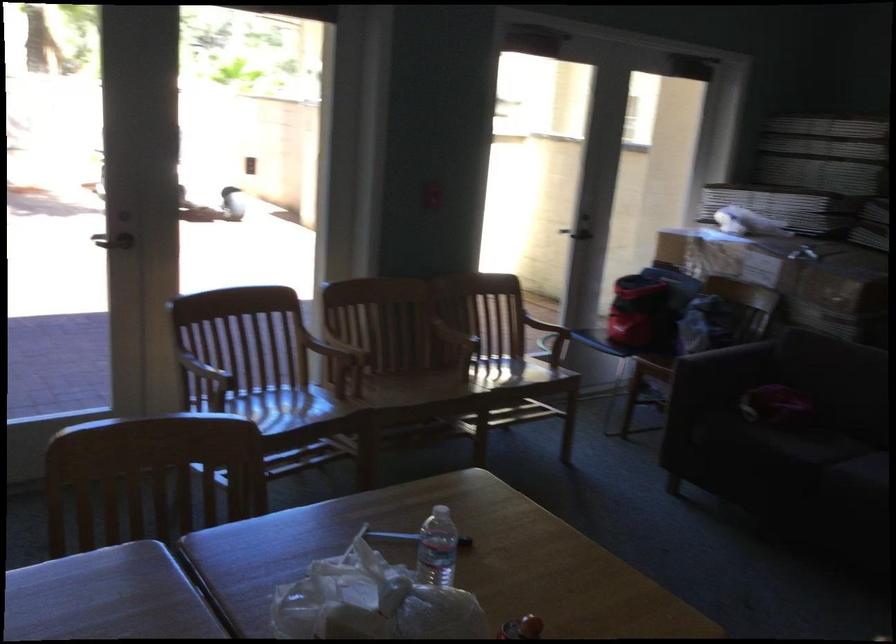
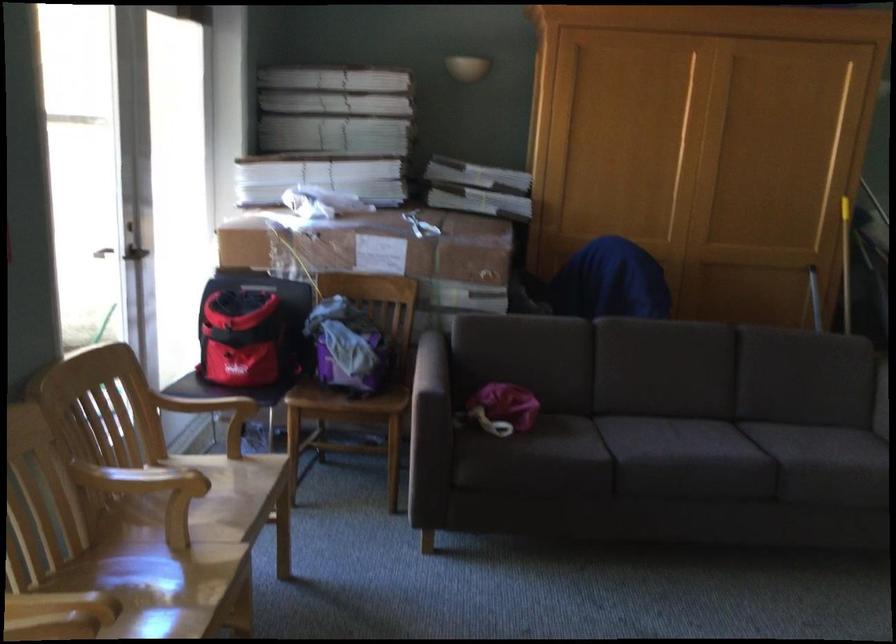
Where in the second image is the point corresponding to point (707, 339) from the first image?

(352, 366)